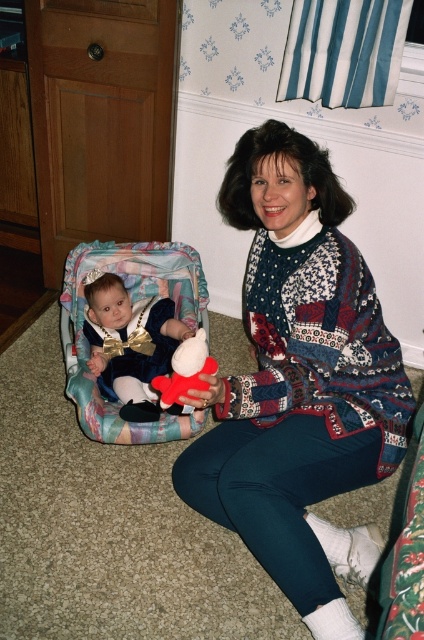
Question: Does patterned sweater at center appear over velvet blue baby at left?

Choices:
 (A) yes
 (B) no

Answer: (B)

Question: Among these objects, which one is nearest to the camera?

Choices:
 (A) velvet blue baby at left
 (B) patterned sweater at center

Answer: (B)

Question: Among these objects, which one is nearest to the camera?

Choices:
 (A) fluffy plush toy at center
 (B) velvet blue baby at left
 (C) patterned sweater at center

Answer: (A)

Question: Is patterned sweater at center to the left of fluffy plush toy at center from the viewer's perspective?

Choices:
 (A) no
 (B) yes

Answer: (A)

Question: Based on their relative distances, which object is farther from the fluffy plush toy at center?

Choices:
 (A) velvet blue baby at left
 (B) patterned sweater at center

Answer: (A)

Question: Does velvet blue baby at left appear under fluffy plush toy at center?

Choices:
 (A) yes
 (B) no

Answer: (B)